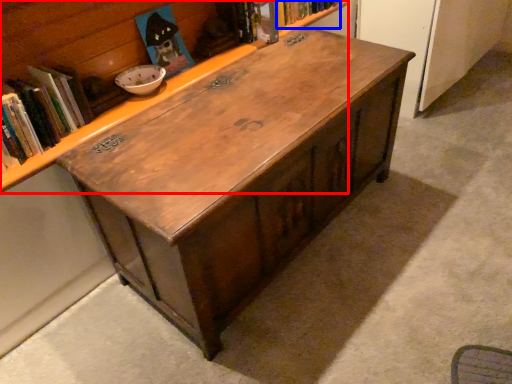
Question: Which point is further to the camera, bookcase (highlighted by a red box) or book (highlighted by a blue box)?

Choices:
 (A) bookcase
 (B) book

Answer: (B)